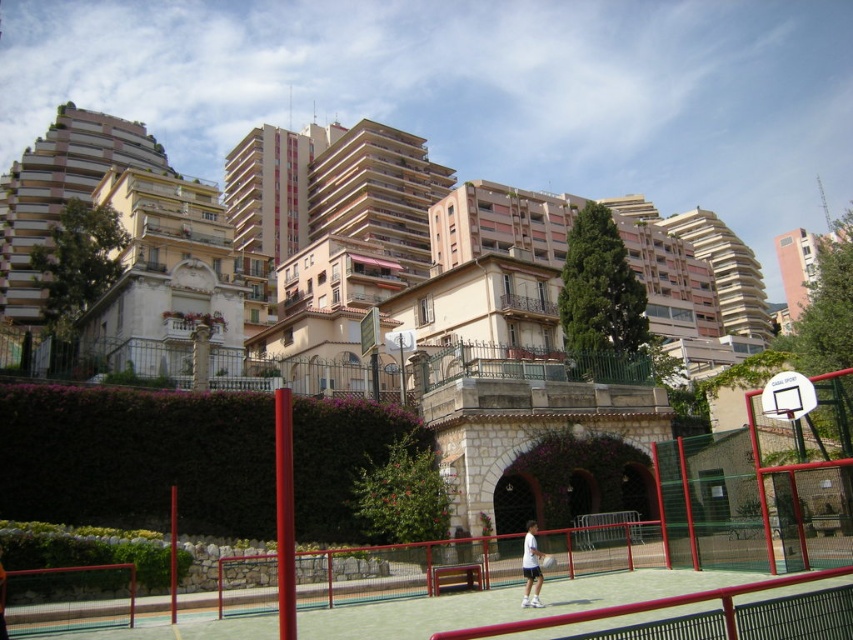
Question: Is white cotton shirt at center positioned behind white rubber tennis racket at center?

Choices:
 (A) no
 (B) yes

Answer: (A)

Question: Which object is closer to the camera taking this photo?

Choices:
 (A) white rubber tennis racket at center
 (B) white cotton shirt at center

Answer: (B)

Question: Observing the image, what is the correct spatial positioning of white cotton shirt at center in reference to white rubber tennis racket at center?

Choices:
 (A) left
 (B) right

Answer: (A)

Question: Which point is closer to the camera?

Choices:
 (A) white cotton shirt at center
 (B) white rubber tennis racket at center

Answer: (A)

Question: Does white cotton shirt at center have a greater width compared to white rubber tennis racket at center?

Choices:
 (A) no
 (B) yes

Answer: (B)